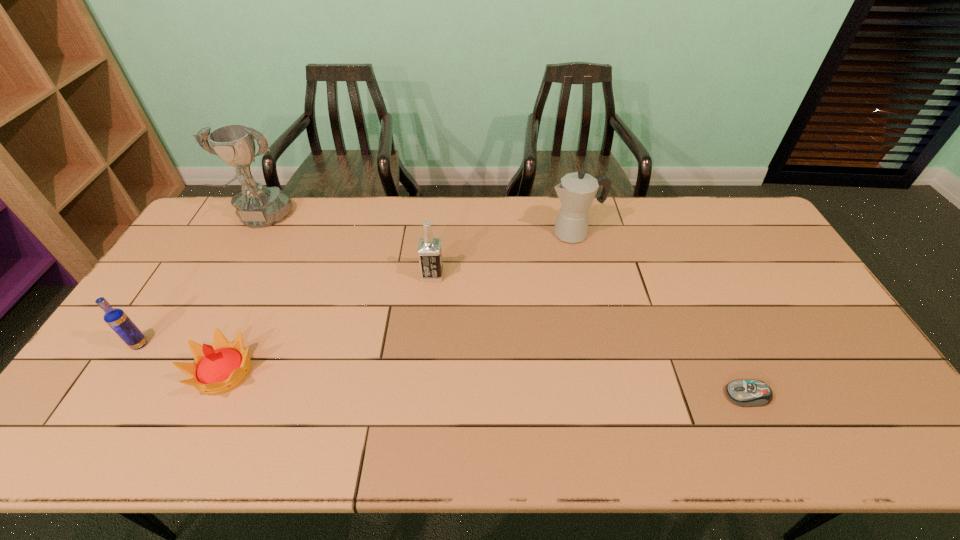
Where is `free space between the second shortest object and the award`? Image resolution: width=960 pixels, height=540 pixels. free space between the second shortest object and the award is located at coordinates (243, 296).

At what (x,y) coordinates should I click in order to perform the action: click on free space between the crown and the coffeepot. Please return your answer as a coordinate pair (x, y). Looking at the image, I should click on (398, 303).

At what (x,y) coordinates should I click in order to perform the action: click on empty space between the fifth tallest object and the tallest object. Please return your answer as a coordinate pair (x, y). Looking at the image, I should click on (243, 296).

You are a GUI agent. You are given a task and a screenshot of the screen. Output one action in this format:
    pyautogui.click(x=<x>, y=<y>)
    Task: Click on the free point between the fourth nearest object and the coffeepot
    
    Given the screenshot: What is the action you would take?
    pyautogui.click(x=503, y=254)

At what (x,y) coordinates should I click in order to perform the action: click on vacant area that lies between the left vodka and the fourth nearest object. Please return your answer as a coordinate pair (x, y). This screenshot has height=540, width=960. Looking at the image, I should click on (286, 309).

Where is `free space between the award and the shortest object`? The height and width of the screenshot is (540, 960). free space between the award and the shortest object is located at coordinates (504, 308).

Find the location of a particular element. The image size is (960, 540). free space that is in between the crown and the second object from right to left is located at coordinates (398, 303).

This screenshot has height=540, width=960. What are the coordinates of `free spot between the fourth nearest object and the crown` in the screenshot? It's located at (328, 323).

This screenshot has width=960, height=540. I want to click on unoccupied position between the nearer vodka and the crown, so click(x=181, y=358).

Locate an element on the screen. This screenshot has width=960, height=540. object that ranks as the third closest to the farther vodka is located at coordinates click(257, 206).